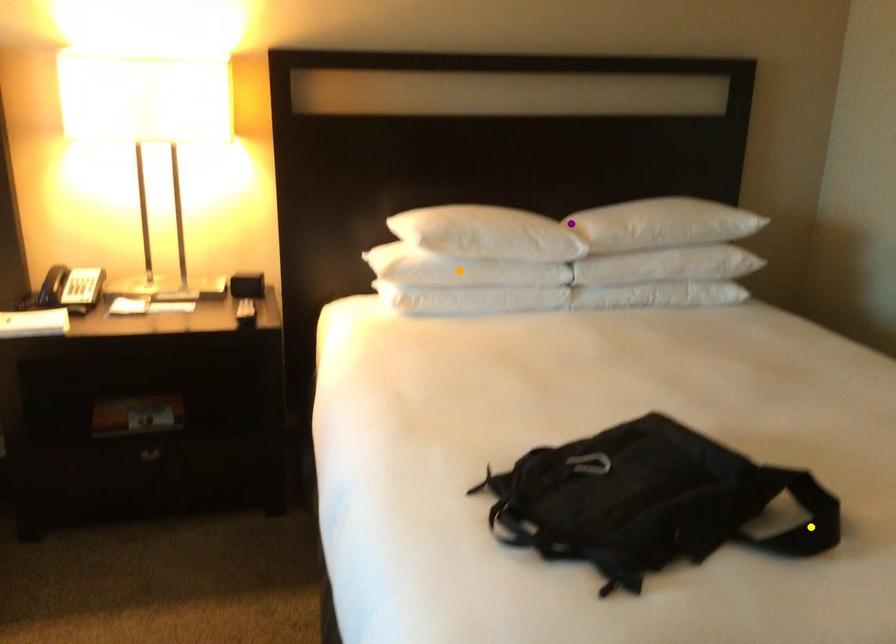
Order these from nearest to farthest:
orange point
purple point
yellow point

yellow point < orange point < purple point